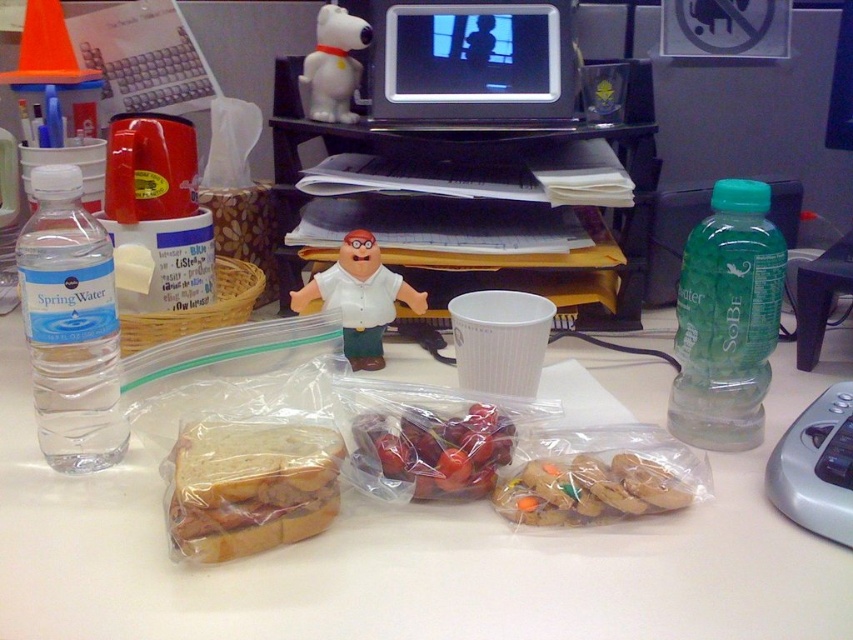
You are organizing the items on the desk and need to place the clear plastic bag at center and the clear plastic bottle at left into a drawer. The drawer has a height limit of 15 cm. Which item might not fit if the bottle is 16 cm tall?

The clear plastic bottle at left is 16 cm tall, which exceeds the 15 cm height limit of the drawer. Therefore, the clear plastic bottle at left might not fit.

You are sitting at the desk and want to reach for an item located at point A and another at point B. If point A is at coordinates point [444,64] and point B is at coordinates point [213,509], which point is closer to you?

Point B at coordinates point [213,509] is closer to you because it is in front of point A at coordinates point [444,64].

You are an office worker who wants to place a new pen on the desk. You need to know if there is enough space between the white matte figurine at center and the white plastic snoopy at upper center. Can you confirm if there is space between them?

The white matte figurine at center is positioned under the white plastic snoopy at upper center, so there is space between them for placing the pen.